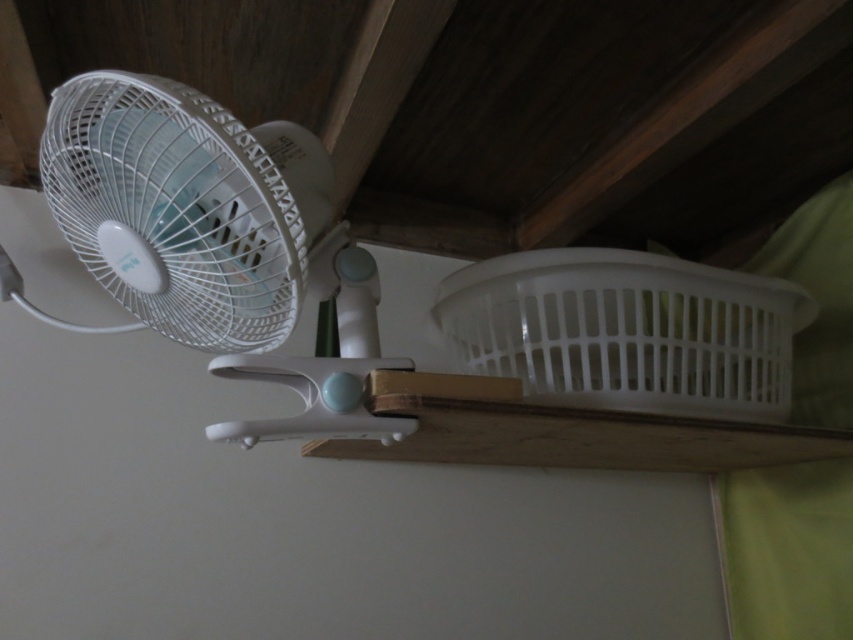
Who is lower down, white plastic fan at left or white plastic basket at upper center?

white plastic basket at upper center is below.

Does white plastic fan at left have a greater width compared to white plastic basket at upper center?

In fact, white plastic fan at left might be narrower than white plastic basket at upper center.

Does point (250, 333) come closer to viewer compared to point (572, 257)?

That is True.

Image resolution: width=853 pixels, height=640 pixels. What are the coordinates of `white plastic fan at left` in the screenshot? It's located at [184, 205].